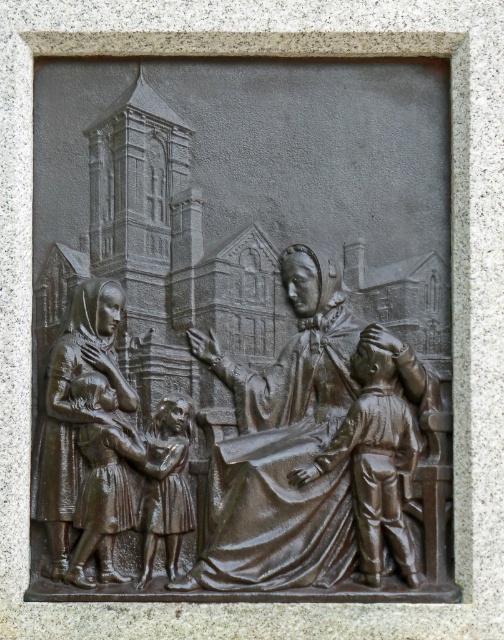
Question: Is matte bronze statue at left further to the viewer compared to bronze statue of woman at center?

Choices:
 (A) yes
 (B) no

Answer: (A)

Question: Is bronze statue at center thinner than matte bronze girl at center?

Choices:
 (A) no
 (B) yes

Answer: (A)

Question: Which of the following is the closest to the observer?

Choices:
 (A) bronze statue at center
 (B) matte bronze statue at left
 (C) matte bronze girl at center

Answer: (A)

Question: Considering the real-world distances, which object is farthest from the matte bronze statue at left?

Choices:
 (A) bronze statue at center
 (B) bronze statue of woman at center
 (C) matte bronze girl at center

Answer: (B)

Question: Does bronze statue at center lie in front of bronze statue of woman at center?

Choices:
 (A) no
 (B) yes

Answer: (B)

Question: Among these points, which one is farthest from the camera?

Choices:
 (A) (295, 378)
 (B) (373, 380)
 (C) (187, 428)

Answer: (A)